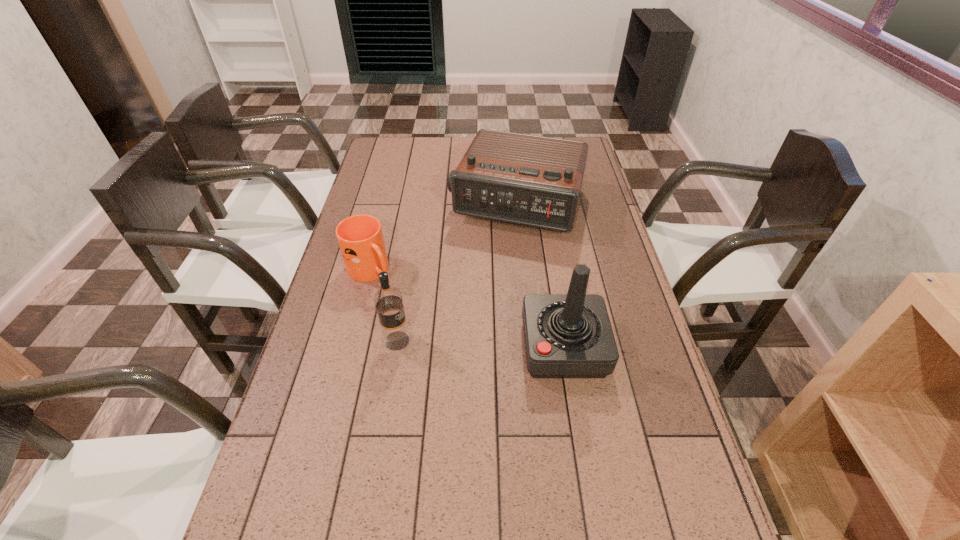
The image size is (960, 540). I want to click on vacant space situated on the handle side of the leftmost object, so click(x=448, y=335).

Locate an element on the screen. This screenshot has width=960, height=540. vacant area situated on the handle side of the leftmost object is located at coordinates (434, 323).

The height and width of the screenshot is (540, 960). What are the coordinates of `free region located 0.350m on the tuning display of the radio receiver` in the screenshot? It's located at (471, 320).

Where is `blank area located 0.200m on the tuning display of the radio receiver`? blank area located 0.200m on the tuning display of the radio receiver is located at coordinates pyautogui.click(x=486, y=282).

This screenshot has width=960, height=540. What are the coordinates of `free space located 0.080m on the tuning display of the radio receiver` in the screenshot? It's located at (495, 257).

Locate an element on the screen. This screenshot has width=960, height=540. object located in the left edge section of the desktop is located at coordinates (360, 237).

In order to click on joystick positioned at the right edge in this screenshot , I will do `click(569, 335)`.

This screenshot has width=960, height=540. In order to click on radio receiver located at the right edge in this screenshot , I will do `click(529, 180)`.

Image resolution: width=960 pixels, height=540 pixels. Identify the location of vacant region at the far edge of the desktop. (444, 145).

This screenshot has width=960, height=540. I want to click on free region at the near edge, so click(x=375, y=498).